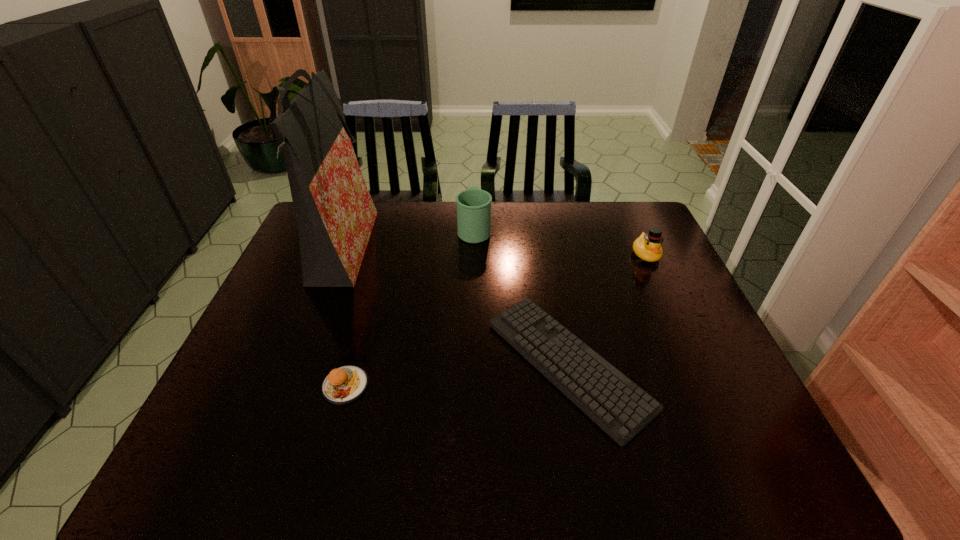
The image size is (960, 540). I want to click on blank region between the fourth tallest object and the shortest object, so click(457, 375).

Locate an element on the screen. This screenshot has width=960, height=540. free space between the second tallest object and the patty is located at coordinates (410, 307).

Identify the location of object that ranks as the second closest to the mug. (621, 408).

Select which object is the second closest to the shopping bag. Please provide its 2D coordinates. Your answer should be formatted as a tuple, i.e. [(x, y)], where the tuple contains the x and y coordinates of a point satisfying the conditions above.

[(473, 205)]

Locate an element on the screen. free space that satisfies the following two spatial constraints: 1. on the front side of the shopping bag; 2. on the left side of the shortest object is located at coordinates (296, 364).

The width and height of the screenshot is (960, 540). Identify the location of vacant space that satisfies the following two spatial constraints: 1. on the front side of the shortest object; 2. on the left side of the shopping bag. (296, 364).

Identify the location of free spot that satisfies the following two spatial constraints: 1. on the front side of the shopping bag; 2. on the right side of the second shortest object. Image resolution: width=960 pixels, height=540 pixels. (287, 386).

The image size is (960, 540). I want to click on vacant position in the image that satisfies the following two spatial constraints: 1. on the front side of the shopping bag; 2. on the right side of the computer keyboard, so click(296, 364).

You are a GUI agent. You are given a task and a screenshot of the screen. Output one action in this format:
    pyautogui.click(x=<x>, y=<y>)
    Task: Click on the free point that satisfies the following two spatial constraints: 1. on the back side of the patty; 2. on the front side of the shopping bag
    
    Given the screenshot: What is the action you would take?
    pyautogui.click(x=382, y=252)